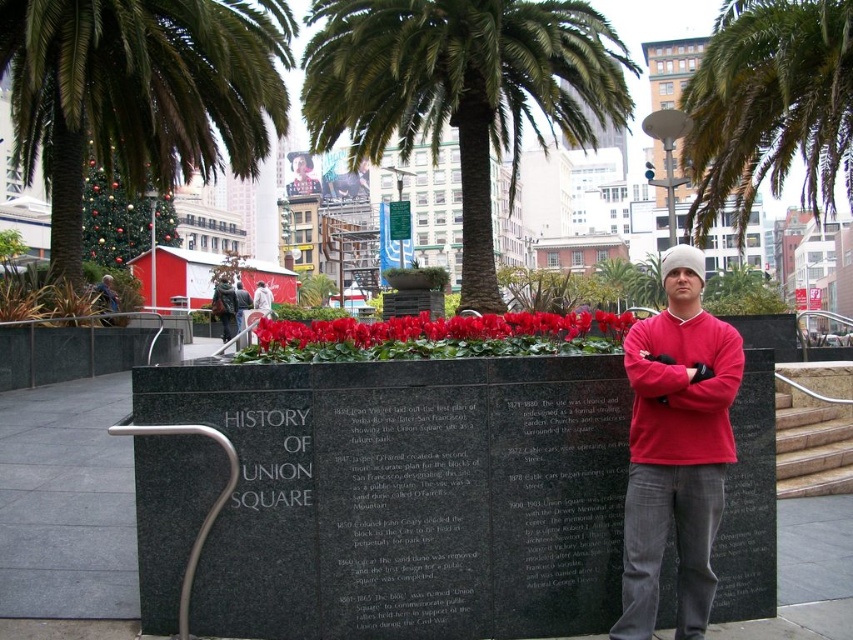
Who is taller, red velvet flowers at center or matte black backpack at center?

Standing taller between the two is matte black backpack at center.

Can you confirm if red velvet flowers at center is taller than matte black backpack at center?

In fact, red velvet flowers at center may be shorter than matte black backpack at center.

The width and height of the screenshot is (853, 640). I want to click on red velvet flowers at center, so click(450, 332).

Which is more to the right, green leafy palm tree at center or green leafy palm tree at upper center?

From the viewer's perspective, green leafy palm tree at upper center appears more on the right side.

Does point (347, 4) come in front of point (711, 173)?

Yes, point (347, 4) is in front of point (711, 173).

At what (x,y) coordinates should I click in order to perform the action: click on green leafy palm tree at center. Please return your answer as a coordinate pair (x, y). This screenshot has height=640, width=853. Looking at the image, I should click on [461, 90].

Is matte red sweater at center taller than red velvet flowers at center?

Indeed, matte red sweater at center has a greater height compared to red velvet flowers at center.

Where is `matte red sweater at center`? matte red sweater at center is located at coordinates (676, 448).